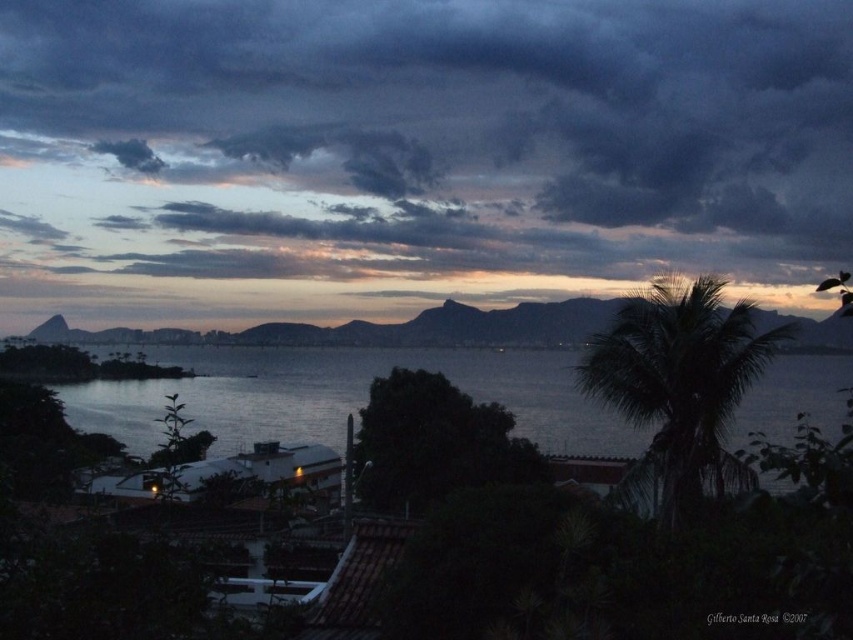
Between dark gray cloud at upper center and dark green leafy palm tree at right, which one is positioned higher?

Positioned higher is dark gray cloud at upper center.

Who is positioned more to the left, dark gray cloud at upper center or dark green leafy palm tree at right?

dark gray cloud at upper center

The image size is (853, 640). Describe the element at coordinates (422, 140) in the screenshot. I see `dark gray cloud at upper center` at that location.

The height and width of the screenshot is (640, 853). In order to click on dark gray cloud at upper center in this screenshot , I will do `click(422, 140)`.

Is dark gray cloud at upper center wider than dark water at center?

Indeed, dark gray cloud at upper center has a greater width compared to dark water at center.

Is point (424, 70) farther from camera compared to point (544, 372)?

Yes, it is behind point (544, 372).

Does point (640, 109) come behind point (564, 429)?

That is True.

The width and height of the screenshot is (853, 640). Find the location of `dark gray cloud at upper center`. dark gray cloud at upper center is located at coordinates (422, 140).

Does point (717, 312) lie behind point (418, 337)?

That is False.

Does dark green leafy palm tree at right appear over silvery metallic water at center?

Incorrect, dark green leafy palm tree at right is not positioned above silvery metallic water at center.

Is point (685, 408) positioned behind point (346, 330)?

No.

In order to click on dark green leafy palm tree at right in this screenshot , I will do `click(679, 387)`.